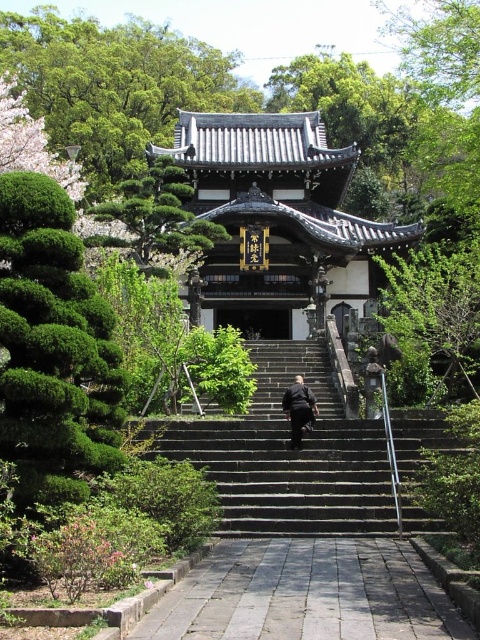
Question: Which of these objects is positioned farthest from the green leafy tree at upper center?

Choices:
 (A) dark gray suit at center
 (B) gray stone path at center
 (C) dark gray stone stairs at center

Answer: (B)

Question: Which object is the farthest from the green leafy tree at upper center?

Choices:
 (A) dark gray stone stairs at center
 (B) gray stone path at center
 (C) dark gray suit at center

Answer: (B)

Question: Can you confirm if gray stone path at center is positioned to the left of green leafy tree at upper center?

Choices:
 (A) yes
 (B) no

Answer: (B)

Question: Based on their relative distances, which object is nearer to the green leafy tree at upper center?

Choices:
 (A) dark gray suit at center
 (B) dark gray stone stairs at center
 (C) gray stone path at center

Answer: (B)

Question: Is dark gray stone stairs at center smaller than dark gray suit at center?

Choices:
 (A) no
 (B) yes

Answer: (A)

Question: Is dark gray stone stairs at center closer to camera compared to dark gray suit at center?

Choices:
 (A) no
 (B) yes

Answer: (B)